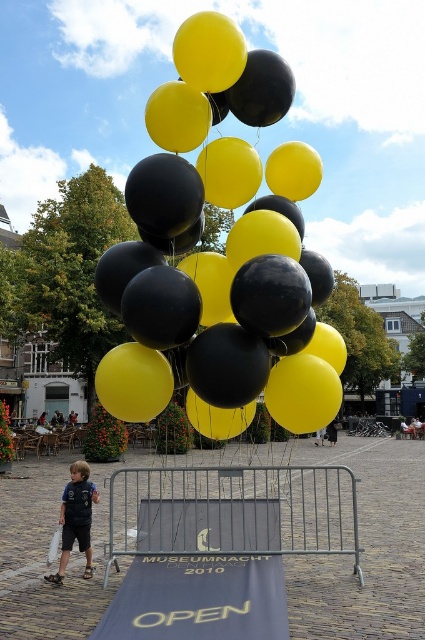
You are a photographer trying to capture a clear shot of the matte black balloon at center and the blue fabric ramp at center. Based on their sizes, which object should you focus on first to ensure it fits entirely within your camera frame?

The matte black balloon at center is taller than the blue fabric ramp at center, so you should focus on capturing the matte black balloon at center first to ensure it fits entirely within your camera frame.

You are standing in front of the balloons and want to touch the two points marked in the image. Which point, point (303, 422) or point (110, 616), is closer to you?

Point (303, 422) is closer to the viewer than point (110, 616).

You are a photographer trying to capture the blue fabric ramp at center without the matte black balloon at center in the frame. Is it possible to adjust your position to exclude the balloon?

The matte black balloon at center is above the blue fabric ramp at center, so moving your camera angle downward or positioning yourself lower might allow you to frame the blue fabric ramp at center without the balloon obstructing the view.